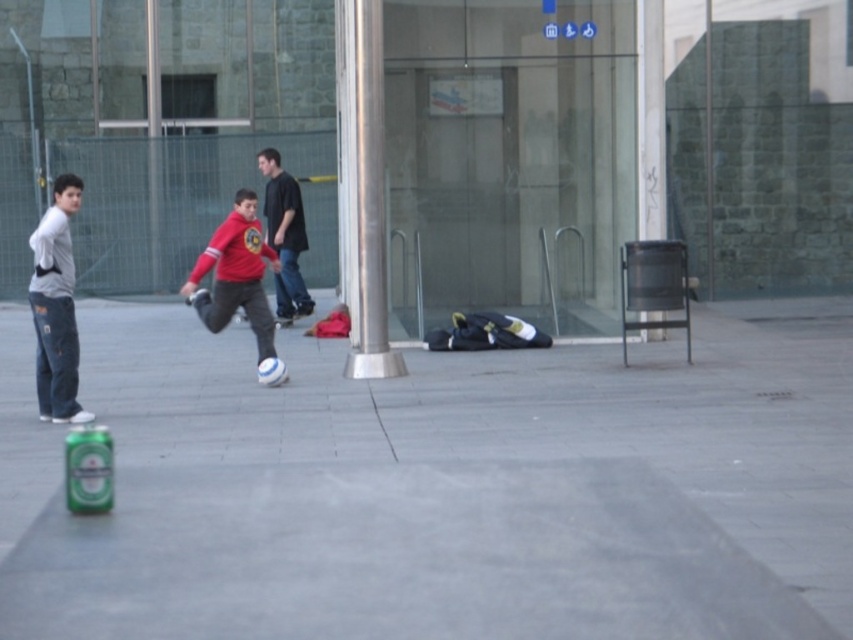
You are standing at the point with coordinates point (x=108, y=504) and want to walk to the point with coordinates point (x=293, y=289). Which direction should you move relative to your current position?

You should move backward because point (x=293, y=289) is behind point (x=108, y=504) relative to your current position.

You are standing at the point marked as point (238,282). What object is located exactly at this point?

The matte red hoodie at center is located exactly at point (238,282).

You are a photographer trying to capture a photo of the matte black shirt at center and the green matte can at lower left. If you want to ensure both objects are in focus, which one should you focus on first, considering their sizes?

The matte black shirt at center is wider than the green matte can at lower left, so focusing on the larger object first would help ensure both are in focus.